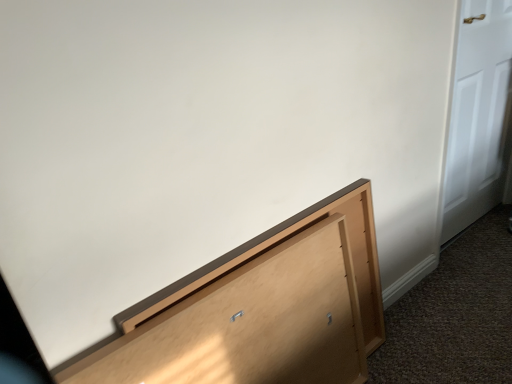
Question: Relative to light brown wood cabinet at lower right, is white glossy door at right in front or behind?

Choices:
 (A) front
 (B) behind

Answer: (B)

Question: Does point (449, 216) appear closer or farther from the camera than point (313, 337)?

Choices:
 (A) farther
 (B) closer

Answer: (A)

Question: Is white glossy door at right taller or shorter than light brown wood cabinet at lower right?

Choices:
 (A) tall
 (B) short

Answer: (A)

Question: From a real-world perspective, is light brown wood cabinet at lower right above or below white glossy door at right?

Choices:
 (A) below
 (B) above

Answer: (A)

Question: Is light brown wood cabinet at lower right inside the boundaries of white glossy door at right, or outside?

Choices:
 (A) inside
 (B) outside

Answer: (B)

Question: Is light brown wood cabinet at lower right taller or shorter than white glossy door at right?

Choices:
 (A) short
 (B) tall

Answer: (A)

Question: Considering the positions of light brown wood cabinet at lower right and white glossy door at right in the image, is light brown wood cabinet at lower right bigger or smaller than white glossy door at right?

Choices:
 (A) small
 (B) big

Answer: (A)